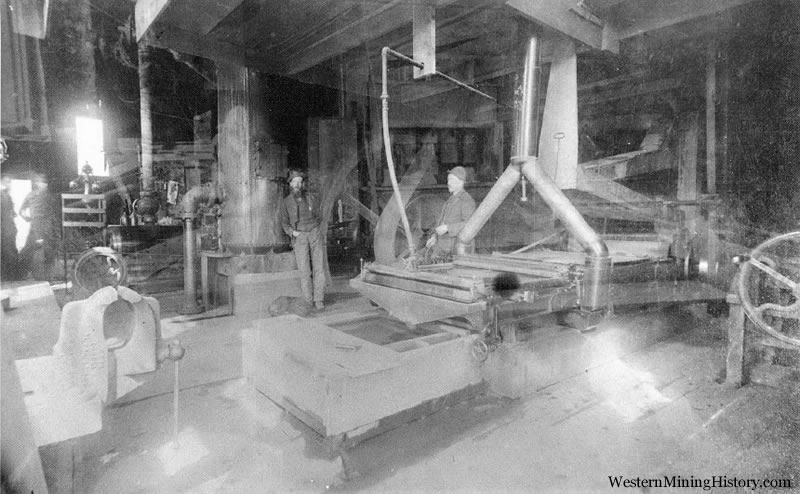
Image resolution: width=800 pixels, height=494 pixels. I want to click on glass table, so click(606, 289).